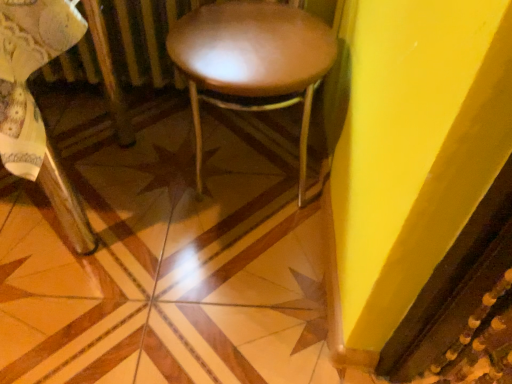
Question: Is wooden chair at center completely or partially inside leather-like brown stool at center?

Choices:
 (A) no
 (B) yes

Answer: (A)

Question: Can you confirm if leather-like brown stool at center is taller than wooden chair at center?

Choices:
 (A) no
 (B) yes

Answer: (A)

Question: Is leather-like brown stool at center closer to the viewer compared to wooden chair at center?

Choices:
 (A) yes
 (B) no

Answer: (B)

Question: Does leather-like brown stool at center have a lesser width compared to wooden chair at center?

Choices:
 (A) yes
 (B) no

Answer: (A)

Question: Is leather-like brown stool at center positioned with its back to wooden chair at center?

Choices:
 (A) no
 (B) yes

Answer: (A)

Question: Considering the relative positions of leather-like brown stool at center and wooden chair at center in the image provided, is leather-like brown stool at center to the right of wooden chair at center from the viewer's perspective?

Choices:
 (A) no
 (B) yes

Answer: (B)

Question: From the image's perspective, is wooden floor at center under wooden chair at center?

Choices:
 (A) no
 (B) yes

Answer: (B)

Question: Is wooden floor at center bigger than wooden chair at center?

Choices:
 (A) yes
 (B) no

Answer: (B)

Question: Considering the relative sizes of wooden floor at center and wooden chair at center in the image provided, is wooden floor at center taller than wooden chair at center?

Choices:
 (A) yes
 (B) no

Answer: (B)

Question: Does wooden floor at center have a smaller size compared to wooden chair at center?

Choices:
 (A) no
 (B) yes

Answer: (B)

Question: Is wooden floor at center located outside wooden chair at center?

Choices:
 (A) no
 (B) yes

Answer: (B)

Question: Is there a large distance between wooden floor at center and wooden chair at center?

Choices:
 (A) no
 (B) yes

Answer: (A)

Question: Can you confirm if wooden chair at center is positioned to the left of wooden floor at center?

Choices:
 (A) no
 (B) yes

Answer: (B)